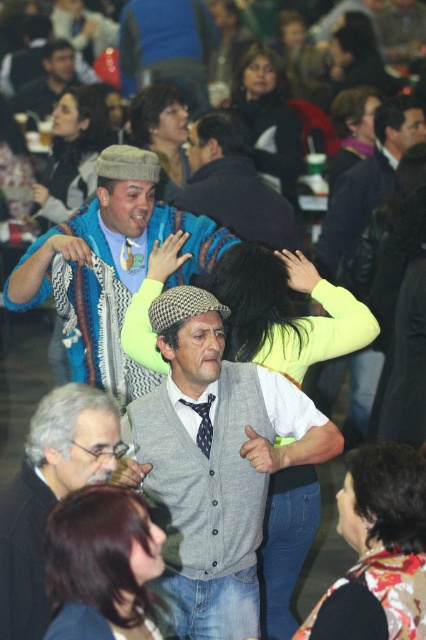
Question: Where is dark brown hair at lower left located in relation to knitted wool sweater at center in the image?

Choices:
 (A) left
 (B) right

Answer: (A)

Question: Based on their relative distances, which object is nearer to the dark purple fabric at upper right?

Choices:
 (A) smooth black hair at center
 (B) shiny brown hair at center
 (C) gray wool sweater at center

Answer: (A)

Question: Is knitted wool sweater at center closer to camera compared to dark purple fabric at upper right?

Choices:
 (A) yes
 (B) no

Answer: (A)

Question: Which is nearer to the gray wool sweater at center?

Choices:
 (A) floral scarf at lower right
 (B) dark brown hair at lower left
 (C) dark purple fabric at upper right
 (D) gray woolen hat at upper right

Answer: (B)

Question: Can you confirm if dark brown hair at lower left is positioned above shiny brown hair at center?

Choices:
 (A) yes
 (B) no

Answer: (B)

Question: Which object is the closest to the smooth black hair at center?

Choices:
 (A) gray woolen hat at upper right
 (B) dark purple fabric at upper right
 (C) knitted wool sweater at center

Answer: (B)